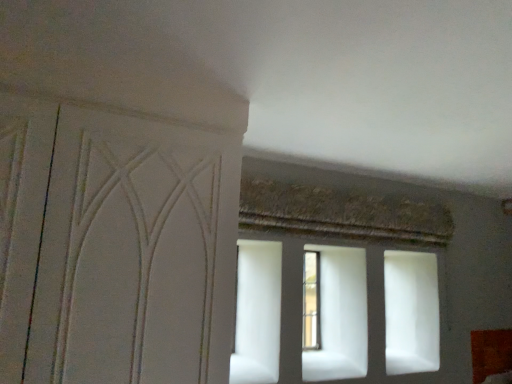
What do you see at coordinates (134, 254) in the screenshot?
I see `white matte screen door at left` at bounding box center [134, 254].

Find the location of a particular element. The height and width of the screenshot is (384, 512). white matte screen door at left is located at coordinates (134, 254).

At what (x,y) coordinates should I click in order to perform the action: click on clear glass window at center. Please return your answer as a coordinate pair (x, y). The width and height of the screenshot is (512, 384). Looking at the image, I should click on (311, 301).

What do you see at coordinates (311, 301) in the screenshot?
I see `clear glass window at center` at bounding box center [311, 301].

This screenshot has height=384, width=512. I want to click on white matte screen door at left, so click(134, 254).

Considering the relative positions of clear glass window at center and white matte screen door at left in the image provided, is clear glass window at center to the left or to the right of white matte screen door at left?

From the image, it's evident that clear glass window at center is to the right of white matte screen door at left.

Is clear glass window at center positioned behind white matte screen door at left?

Yes, it is.

Considering the points (318, 323) and (44, 288), which point is in front, point (318, 323) or point (44, 288)?

The point (44, 288) is in front.

From the image's perspective, is clear glass window at center on top of white matte screen door at left?

No, from the image's perspective, clear glass window at center is not above white matte screen door at left.

Based on the photo, from a real-world perspective, is clear glass window at center positioned over white matte screen door at left based on gravity?

No, from a real-world perspective, clear glass window at center is not on top of white matte screen door at left.

Which object is wider, clear glass window at center or white matte screen door at left?

white matte screen door at left.

From their relative heights in the image, would you say clear glass window at center is taller or shorter than white matte screen door at left?

In the image, clear glass window at center appears to be shorter than white matte screen door at left.

Which of these two, clear glass window at center or white matte screen door at left, is bigger?

white matte screen door at left is bigger.

Is clear glass window at center outside of white matte screen door at left?

clear glass window at center lies outside white matte screen door at left's area.

Is clear glass window at center next to white matte screen door at left?

No, clear glass window at center is not beside white matte screen door at left.

Could you tell me if clear glass window at center is facing white matte screen door at left?

No, clear glass window at center is not facing towards white matte screen door at left.

At what (x,y) coordinates should I click in order to perform the action: click on screen door above the clear glass window at center (from a real-world perspective). Please return your answer as a coordinate pair (x, y). Looking at the image, I should click on [134, 254].

Would you say white matte screen door at left is to the left or to the right of clear glass window at center in the picture?

white matte screen door at left is to the left of clear glass window at center.

Does white matte screen door at left lie in front of clear glass window at center?

Yes, white matte screen door at left is in front of clear glass window at center.

Does point (126, 368) come behind point (311, 348)?

No, (126, 368) is closer to viewer.

From the image's perspective, is white matte screen door at left positioned above or below clear glass window at center?

Clearly, from the image's perspective, white matte screen door at left is above clear glass window at center.

From a real-world perspective, is white matte screen door at left on top of clear glass window at center?

Yes.

In the scene shown: Looking at their sizes, would you say white matte screen door at left is wider or thinner than clear glass window at center?

Clearly, white matte screen door at left has more width compared to clear glass window at center.

Considering the relative sizes of white matte screen door at left and clear glass window at center in the image provided, is white matte screen door at left shorter than clear glass window at center?

Incorrect, the height of white matte screen door at left does not fall short of that of clear glass window at center.

Consider the image. Looking at the image, does white matte screen door at left seem bigger or smaller compared to clear glass window at center?

Clearly, white matte screen door at left is larger in size than clear glass window at center.

Would you say clear glass window at center is part of white matte screen door at left's contents?

That's incorrect, clear glass window at center is not inside white matte screen door at left.

Is white matte screen door at left not near clear glass window at center?

Yes, white matte screen door at left and clear glass window at center are located far from each other.

Is white matte screen door at left facing away from clear glass window at center?

white matte screen door at left does not have its back to clear glass window at center.

How much distance is there between white matte screen door at left and clear glass window at center?

white matte screen door at left is 1.47 meters from clear glass window at center.

The width and height of the screenshot is (512, 384). I want to click on screen door located in front of the clear glass window at center, so click(134, 254).

Locate an element on the screen. screen door above the clear glass window at center (from a real-world perspective) is located at coordinates pos(134,254).

Where is `screen door above the clear glass window at center (from the image's perspective)`? screen door above the clear glass window at center (from the image's perspective) is located at coordinates (134, 254).